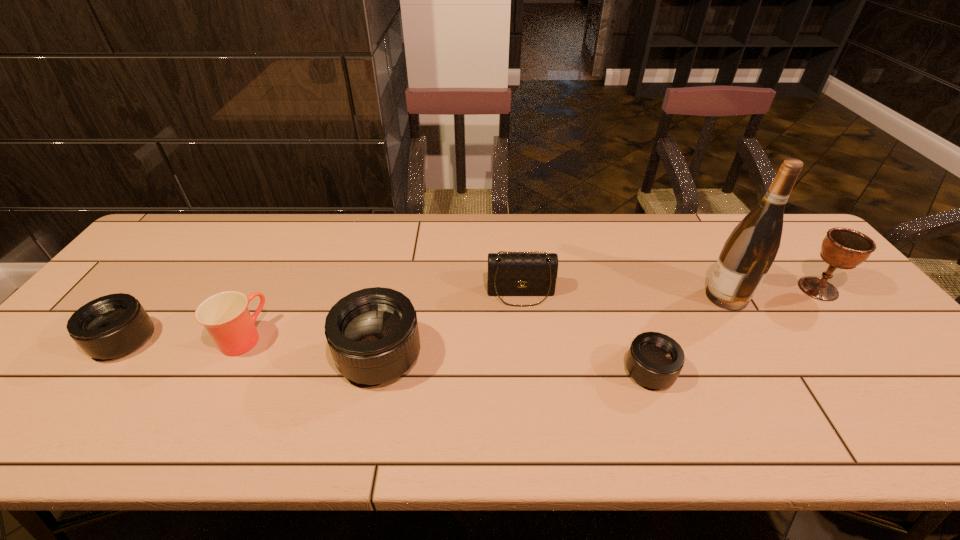
Where is `the second tallest object`? the second tallest object is located at coordinates (843, 248).

Find the location of a particular element. This screenshot has width=960, height=540. the second object from left to right is located at coordinates 225,315.

The image size is (960, 540). What are the coordinates of `free space located on the side of the third object from left to right with brand markings and control switches` in the screenshot? It's located at [260, 355].

Identify the location of blank space located 0.400m on the side of the third object from left to right with brand markings and control switches. This screenshot has width=960, height=540. (169, 355).

You are a GUI agent. You are given a task and a screenshot of the screen. Output one action in this format:
    pyautogui.click(x=<x>, y=<y>)
    Task: Click on the vacant space located on the side of the third object from left to right with brand markings and control switches
    This screenshot has width=960, height=540.
    Given the screenshot: What is the action you would take?
    pyautogui.click(x=227, y=355)

You are a GUI agent. You are given a task and a screenshot of the screen. Output one action in this format:
    pyautogui.click(x=<x>, y=<y>)
    Task: Click on the vacant region located on the side of the shortest telephoto lens with brand markings and control switches
    
    Given the screenshot: What is the action you would take?
    pyautogui.click(x=843, y=372)

The image size is (960, 540). What are the coordinates of `free space located on the front flap of the clutch bag` in the screenshot? It's located at (530, 382).

Image resolution: width=960 pixels, height=540 pixels. Identify the location of free point located 0.240m on the label of the sixth object from left to right. (x=618, y=296).

Identify the location of blank space located on the label of the sixth object from left to right. (600, 296).

The width and height of the screenshot is (960, 540). In order to click on vacant space located on the label of the sixth object from left to right in this screenshot , I will do `click(680, 296)`.